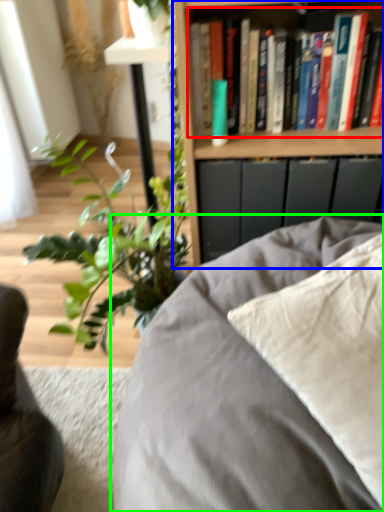
Question: Which object is positioned closest to book (highlighted by a red box)? Select from bookcase (highlighted by a blue box) and furniture (highlighted by a green box).

Choices:
 (A) bookcase
 (B) furniture

Answer: (A)